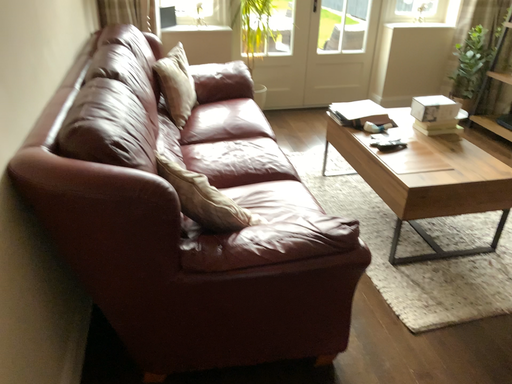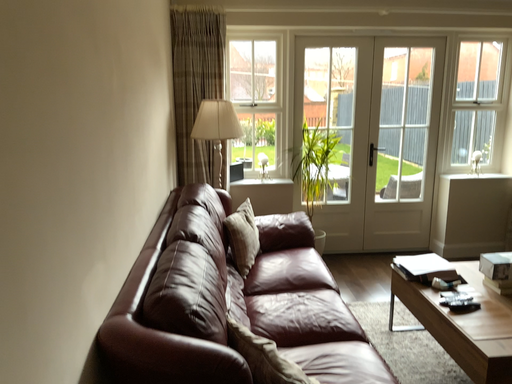
Question: Which way did the camera rotate in the video?

Choices:
 (A) rotated downward
 (B) rotated upward

Answer: (B)